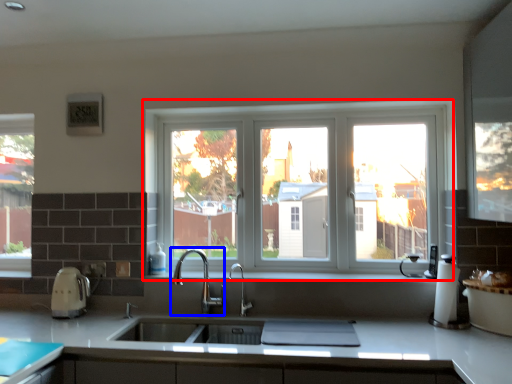
Question: Which point is closer to the camera, window (highlighted by a red box) or tap (highlighted by a blue box)?

Choices:
 (A) window
 (B) tap

Answer: (B)